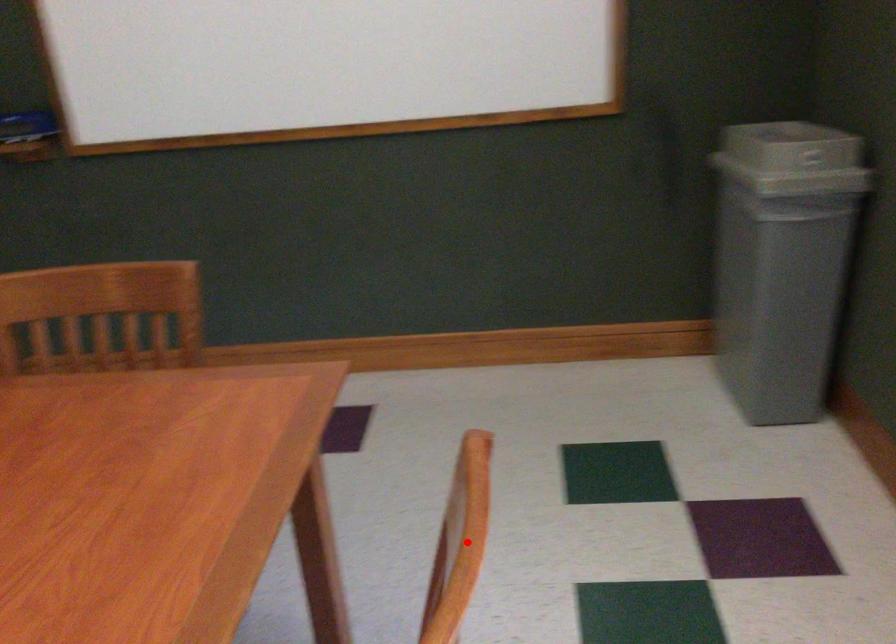
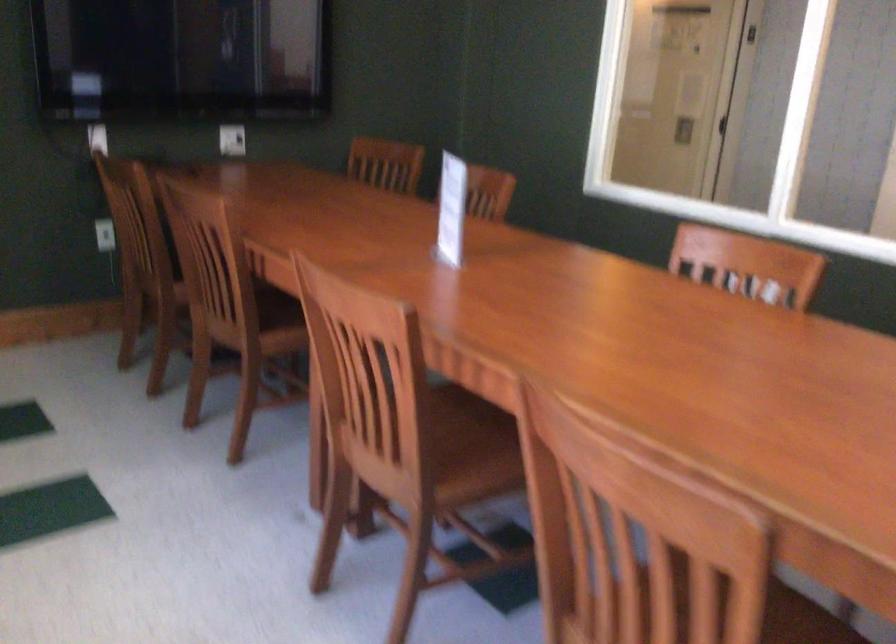
Question: I am providing you with two images of the same scene from different viewpoints. A red point is marked on the first image. At the location where the point appears in image 1, is it still visible in image 2?

Choices:
 (A) Yes
 (B) No

Answer: (A)